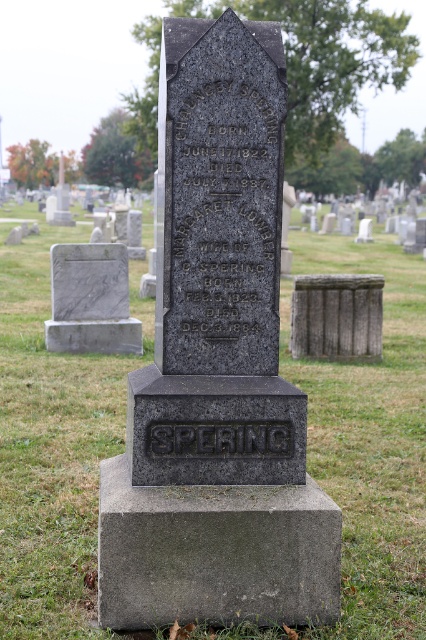
You are standing in front of the gravestone and want to touch both the gray stone base at center and the black granite stone at center. Which part should you reach for first to touch the one closer to you?

The gray stone base at center is closer to the viewer than the black granite stone at center, so you should reach for the gray stone base at center first.

What is the spatial relationship between the black granite stone at center and the gray stone box at center?

The black granite stone at center is positioned over the gray stone box at center.

You are standing at the center of the cemetery and see the green grass at center and the white marble gravestone at left. How far apart are these two landmarks?

The green grass at center is 9.68 feet from the white marble gravestone at left.